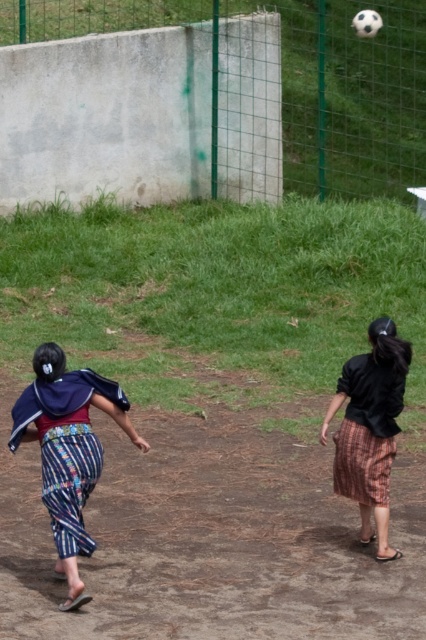
Question: Considering the relative positions of striped fabric pants at lower left and black cotton shirt at center in the image provided, where is striped fabric pants at lower left located with respect to black cotton shirt at center?

Choices:
 (A) below
 (B) above

Answer: (A)

Question: Can you confirm if striped fabric pants at lower left is bigger than black cotton shirt at center?

Choices:
 (A) yes
 (B) no

Answer: (A)

Question: Which point is closer to the camera taking this photo?

Choices:
 (A) (350, 404)
 (B) (80, 413)

Answer: (B)

Question: Is striped fabric pants at lower left below black cotton shirt at center?

Choices:
 (A) no
 (B) yes

Answer: (B)